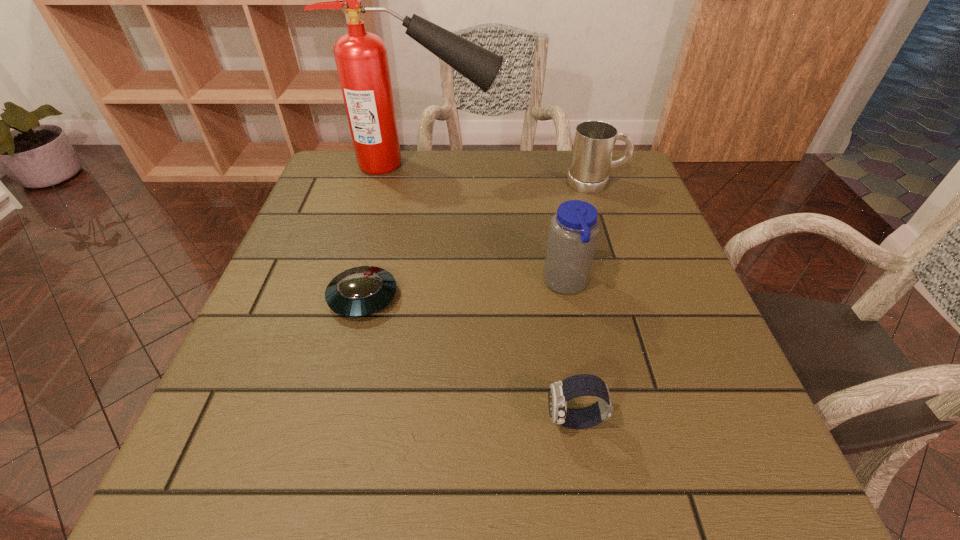
Image resolution: width=960 pixels, height=540 pixels. I want to click on vacant space situated with a carrying loop on the side of the second tallest object, so click(x=400, y=284).

I want to click on vacant point located on the face of the nearest object, so click(495, 421).

Image resolution: width=960 pixels, height=540 pixels. I want to click on vacant area situated 0.140m on the face of the nearest object, so click(x=457, y=421).

The image size is (960, 540). Find the location of `free space located 0.080m on the face of the nearest object`. free space located 0.080m on the face of the nearest object is located at coordinates (495, 421).

You are a GUI agent. You are given a task and a screenshot of the screen. Output one action in this format:
    pyautogui.click(x=<x>, y=<y>)
    Task: Click on the vacant space located on the back of the shortest object
    The height and width of the screenshot is (540, 960).
    Given the screenshot: What is the action you would take?
    pyautogui.click(x=392, y=185)

This screenshot has height=540, width=960. Identify the location of fire extinguisher that is at the far edge. (361, 58).

Locate an element on the screen. The height and width of the screenshot is (540, 960). mug that is at the far edge is located at coordinates (594, 141).

Locate an element on the screen. Image resolution: width=960 pixels, height=540 pixels. fire extinguisher positioned at the left edge is located at coordinates (361, 58).

You are a GUI agent. You are given a task and a screenshot of the screen. Output one action in this format:
    pyautogui.click(x=<x>, y=<y>)
    Task: Click on the saucer situated at the left edge
    
    Given the screenshot: What is the action you would take?
    point(361,291)

The width and height of the screenshot is (960, 540). In order to click on object located in the right edge section of the desktop in this screenshot , I will do `click(594, 141)`.